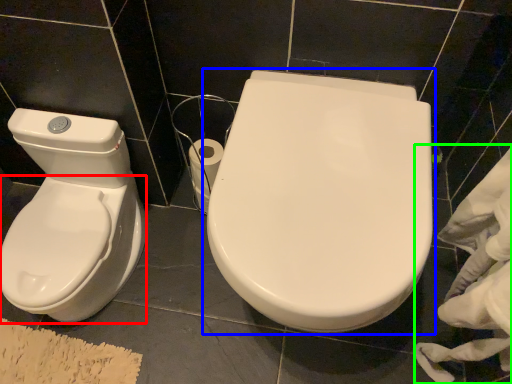
Question: Based on their relative distances, which object is farther from bidet (highlighted by a red box)? Choose from toilet (highlighted by a blue box) and material (highlighted by a green box).

Choices:
 (A) toilet
 (B) material

Answer: (B)